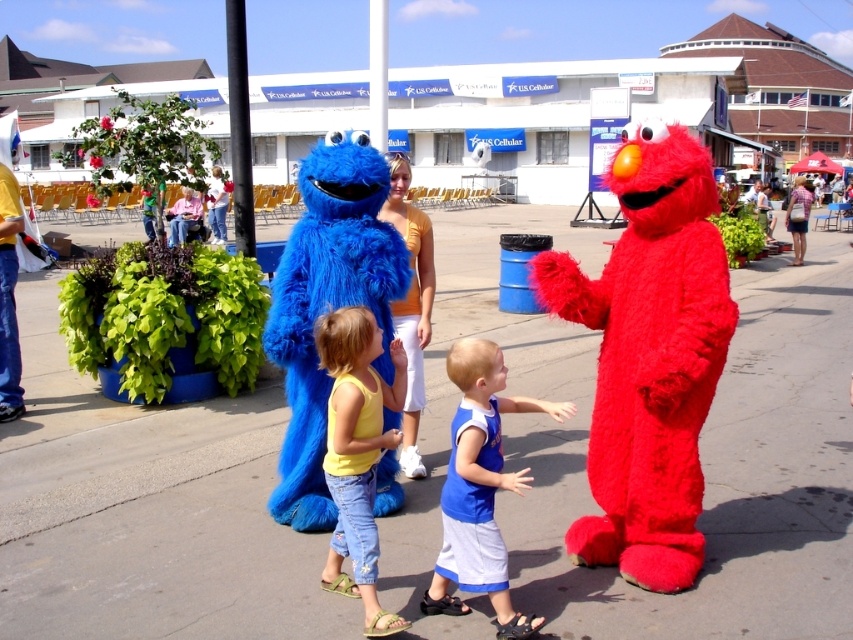
You are a costume designer working on a Sesame Street event. You need to ensure that the clothing items worn by the children in the image are proportionate to their bodies. Which clothing item, the yellow cotton tank top at center or the denim shorts at center, is narrower?

The yellow cotton tank top at center has a lesser width compared to the denim shorts at center, so the yellow cotton tank top at center is narrower.

You are a photographer at the event and want to capture a photo of the yellow cotton tank top at center. According to the coordinates provided, where should you aim your camera?

The yellow cotton tank top at center is located at coordinates point (357, 451).